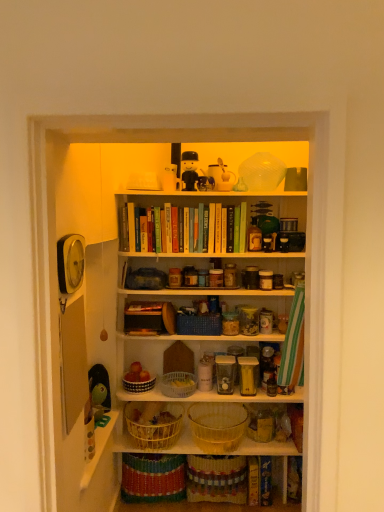
Question: Considering the relative sizes of white woven basket at lower center, the 2th basket when ordered from top to bottom, and black plastic toy at upper center, the 2th toy when ordered from left to right, in the image provided, is white woven basket at lower center, the 2th basket when ordered from top to bottom, taller than black plastic toy at upper center, the 2th toy when ordered from left to right,?

Choices:
 (A) yes
 (B) no

Answer: (B)

Question: Could you tell me if white woven basket at lower center, the 4th basket positioned from the bottom, is facing black plastic toy at upper center, which is the fourth toy in bottom-to-top order?

Choices:
 (A) no
 (B) yes

Answer: (A)

Question: Is white woven basket at lower center, the 2th basket when ordered from top to bottom, to the right of black plastic toy at upper center, the 2th toy when ordered from left to right, from the viewer's perspective?

Choices:
 (A) yes
 (B) no

Answer: (B)

Question: Is white woven basket at lower center, the 4th basket positioned from the bottom, behind black plastic toy at upper center, the 2th toy when ordered from left to right?

Choices:
 (A) no
 (B) yes

Answer: (B)

Question: Considering the relative sizes of white woven basket at lower center, the 4th basket positioned from the bottom, and black plastic toy at upper center, which is counted as the 1th toy, starting from the top, in the image provided, is white woven basket at lower center, the 4th basket positioned from the bottom, shorter than black plastic toy at upper center, which is counted as the 1th toy, starting from the top,?

Choices:
 (A) yes
 (B) no

Answer: (A)

Question: Looking at the image, does wooden shelf at center, the second shelf positioned from the bottom, seem bigger or smaller compared to white plastic spoon at upper center, the 3th toy in the bottom-to-top sequence?

Choices:
 (A) small
 (B) big

Answer: (B)

Question: From the image's perspective, is wooden shelf at center, the 2th shelf viewed from the back, above or below white plastic spoon at upper center, arranged as the second toy when viewed from the top?

Choices:
 (A) below
 (B) above

Answer: (A)

Question: Is wooden shelf at center, the 2th shelf viewed from the back, to the left or to the right of white plastic spoon at upper center, acting as the 4th toy starting from the left, in the image?

Choices:
 (A) left
 (B) right

Answer: (A)

Question: From a real-world perspective, is wooden shelf at center, acting as the first shelf starting from the front, physically located above or below white plastic spoon at upper center, the 3th toy in the bottom-to-top sequence?

Choices:
 (A) below
 (B) above

Answer: (A)

Question: From a real-world perspective, is white plastic spoon at upper center, the 3th toy in the bottom-to-top sequence, above or below yellow wicker basket at lower center, the fifth basket positioned from the top?

Choices:
 (A) above
 (B) below

Answer: (A)

Question: Considering the positions of point (230, 181) and point (160, 420), is point (230, 181) closer or farther from the camera than point (160, 420)?

Choices:
 (A) closer
 (B) farther

Answer: (A)

Question: In terms of width, does white plastic spoon at upper center, acting as the 4th toy starting from the left, look wider or thinner when compared to yellow wicker basket at lower center, the 1th basket when ordered from bottom to top?

Choices:
 (A) thin
 (B) wide

Answer: (A)

Question: Visually, is white plastic spoon at upper center, the 3th toy in the bottom-to-top sequence, positioned to the left or to the right of yellow wicker basket at lower center, the 1th basket when ordered from bottom to top?

Choices:
 (A) right
 (B) left

Answer: (A)

Question: Is clear plastic basket at center, the third basket ordered from the bottom, to the left or to the right of green rubber duck at left, positioned as the first toy in left-to-right order, in the image?

Choices:
 (A) right
 (B) left

Answer: (A)

Question: Is clear plastic basket at center, the third basket ordered from the bottom, inside the boundaries of green rubber duck at left, positioned as the fourth toy in top-to-bottom order, or outside?

Choices:
 (A) outside
 (B) inside

Answer: (A)